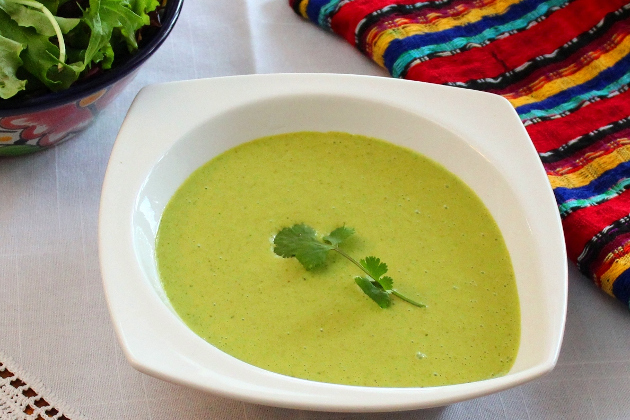
Locate an element on the screen. Image resolution: width=630 pixels, height=420 pixels. table is located at coordinates (38, 406).